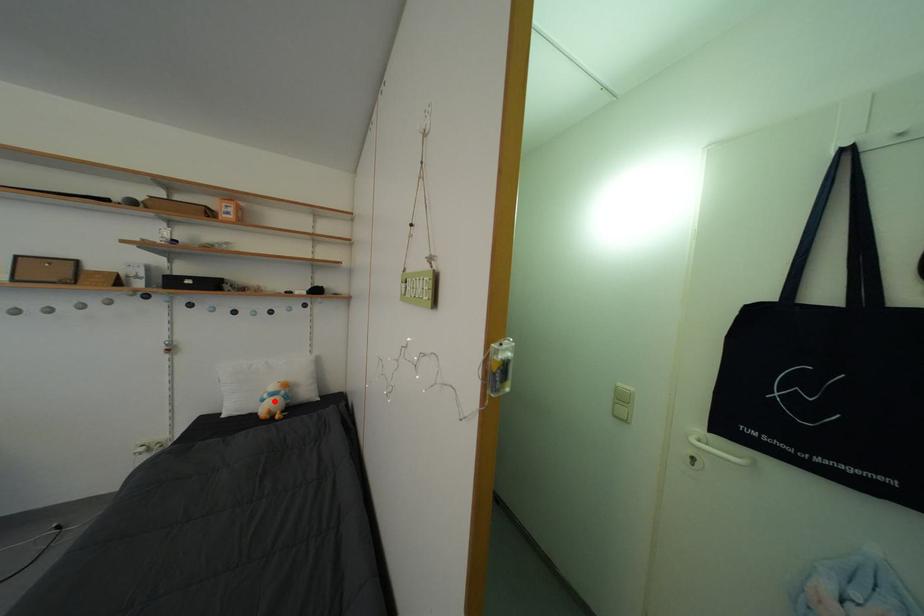
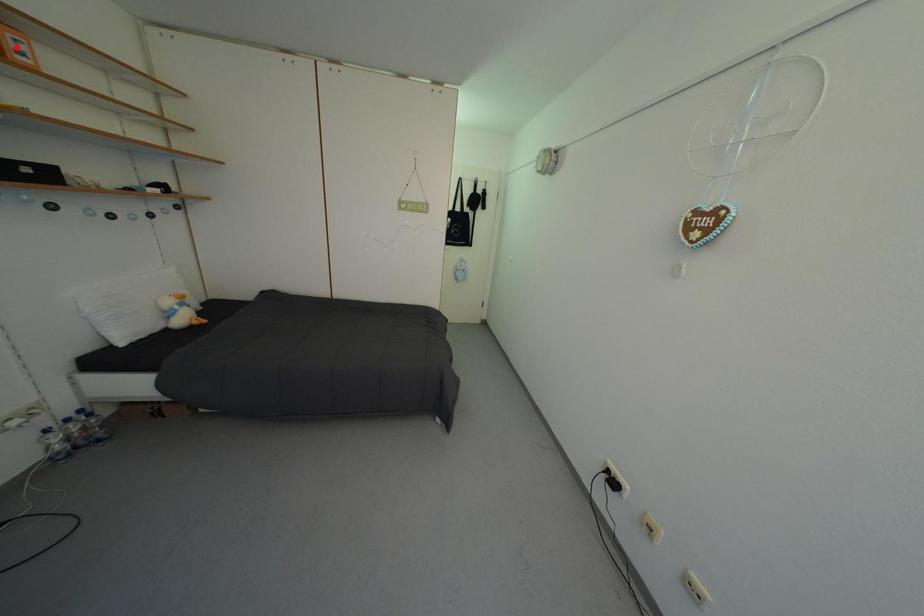
I am providing you with two images of the same scene from different viewpoints. A red point is marked on the first image and another point is marked on the second image. Is the marked point in image1 the same physical position as the marked point in image2?

No